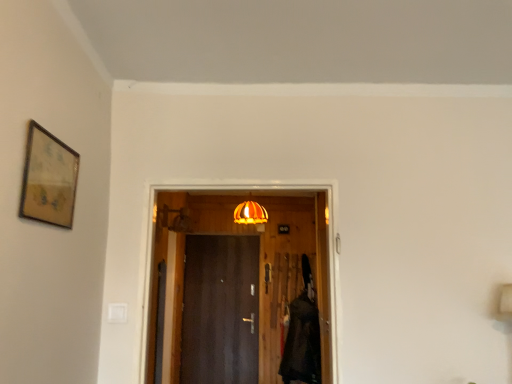
Question: Considering the positions of wooden door at center, the second door from the back, and orange glass lampshade at center in the image, is wooden door at center, the second door from the back, taller or shorter than orange glass lampshade at center?

Choices:
 (A) tall
 (B) short

Answer: (A)

Question: Which is correct: wooden door at center, the second door when ordered from bottom to top, is inside orange glass lampshade at center, or outside of it?

Choices:
 (A) inside
 (B) outside

Answer: (B)

Question: Based on their relative distances, which object is nearer to the velvet black robe at right?

Choices:
 (A) wooden-framed artwork at upper left
 (B) wooden door at center, the second door when ordered from bottom to top
 (C) orange glass lampshade at center
 (D) dark wood door at center, the 2th door when ordered from front to back

Answer: (B)

Question: Estimate the real-world distances between objects in this image. Which object is closer to the dark wood door at center, acting as the 1th door starting from the back?

Choices:
 (A) wooden door at center, arranged as the 1th door when viewed from the front
 (B) orange glass lampshade at center
 (C) velvet black robe at right
 (D) wooden-framed artwork at upper left

Answer: (A)